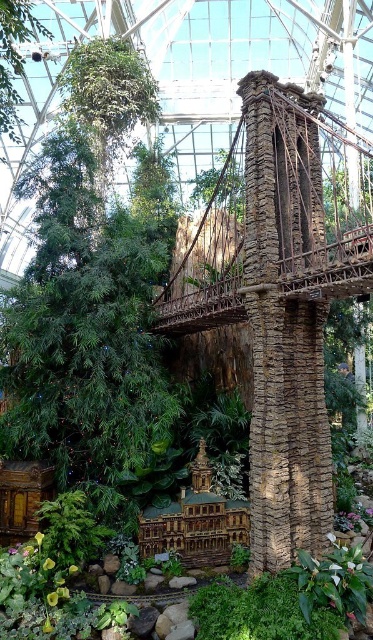
Consider the image. You are standing at the entrance of the botanical garden and want to find the green leafy tree at upper left. Which direction should you look to see it relative to the green leafy tree at center?

The green leafy tree at upper left is above the green leafy tree at center, so you should look upwards to see it relative to the green leafy tree at center.

You are standing at the entrance of the indoor botanical garden and see the point marked as point (x=88, y=291). What object does this point correspond to?

The point (x=88, y=291) corresponds to the green leafy tree at center.

You are standing in the botanical garden and want to take a photo of both the point at coordinates (102, 442) and the point at (10, 120). Which point will appear larger in your camera view?

Point (102, 442) is closer to the camera than point (10, 120), so it will appear larger in the photo.